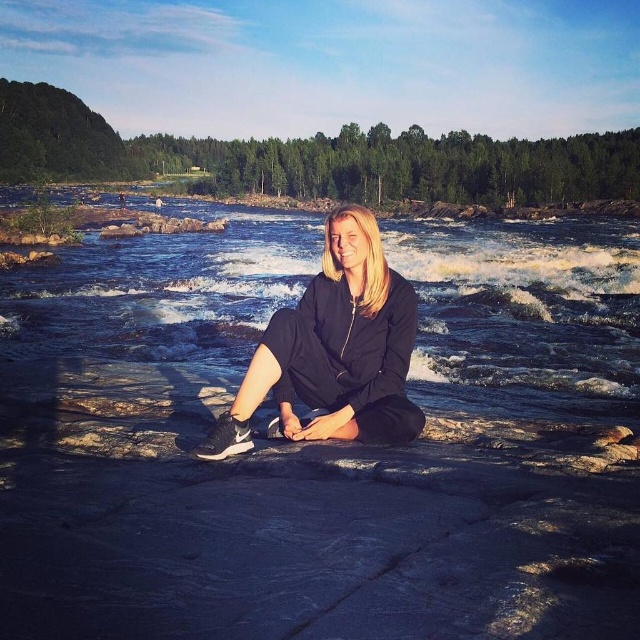
You are planning to cross the smooth stone creek at center while wearing the black matte tracksuit at center. Considering their sizes, will the tracksuit fully cover your body when you step into the creek?

The smooth stone creek at center is larger than the black matte tracksuit at center. Since the creek is bigger, the tracksuit might not fully cover your body when stepping into it.

You are a photographer standing at the edge of the smooth stone creek at center and want to take a photo of the black matte tracksuit at center. Which direction should you move to position yourself directly in front of the subject?

Since the smooth stone creek at center is to the right of the black matte tracksuit at center, you should move to your left to position yourself directly in front of the subject.

You are a photographer wanting to capture the black matte tracksuit at center and the smooth stone creek at center in the same frame. Since both are at the center, how can you adjust your camera angle to include both objects without moving the subject?

The smooth stone creek at center is taller than the black matte tracksuit at center. To include both in the frame, tilt the camera upward to capture the taller creek while still framing the tracksuit below.